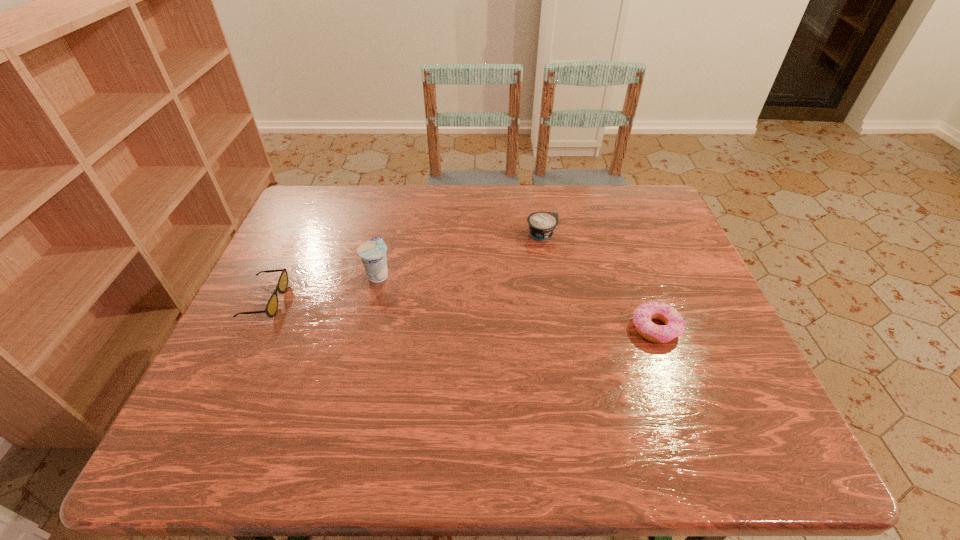
Where is `the left yogurt`? the left yogurt is located at coordinates (372, 252).

You are a GUI agent. You are given a task and a screenshot of the screen. Output one action in this format:
    pyautogui.click(x=<x>, y=<y>)
    Task: Click on the tallest object
    The height and width of the screenshot is (540, 960).
    Given the screenshot: What is the action you would take?
    pyautogui.click(x=372, y=252)

Where is `the third object from left to right`? the third object from left to right is located at coordinates (542, 224).

The width and height of the screenshot is (960, 540). I want to click on the farthest object, so click(x=542, y=224).

The height and width of the screenshot is (540, 960). I want to click on sunglasses, so click(x=271, y=308).

Locate an element on the screen. the rightmost object is located at coordinates (674, 326).

Where is `doughnut`? This screenshot has width=960, height=540. doughnut is located at coordinates (674, 326).

Find the location of a particular element. free space located on the back of the second object from left to right is located at coordinates (x=398, y=190).

The image size is (960, 540). What are the coordinates of `vacant space located on the back of the right yogurt` in the screenshot? It's located at (537, 202).

Where is `blank space located 0.350m on the front-facing side of the sunglasses`? blank space located 0.350m on the front-facing side of the sunglasses is located at coordinates (423, 301).